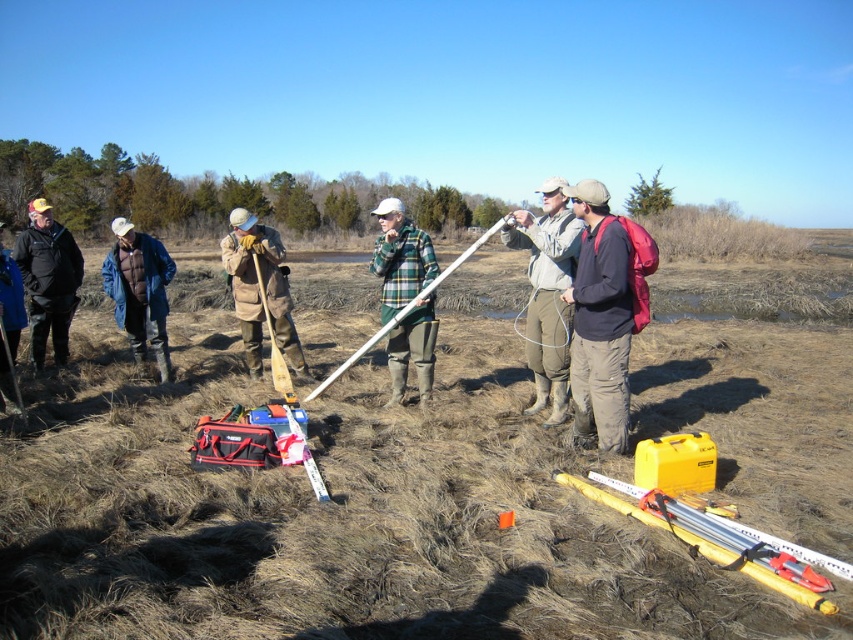
You are part of the fieldwork team and need to determine which clothing item is more suitable for storing small items in its pockets. Based on the description of the brown fuzzy coat at center and the green plaid shirt at center, which one would you choose?

The brown fuzzy coat at center is thinner than the green plaid shirt at center, so the green plaid shirt at center is thicker and likely has more substantial pockets for storing small items.

You are a member of the fieldwork team and need to locate the blue denim jacket at left. According to the coordinates provided, where exactly should you look?

The blue denim jacket at left is located at point (138, 291).

You are standing in the field and see a point marked at coordinates (693, 536). If you need to reach that point, how far will you have to walk?

The distance of point (693, 536) from the viewer is 3.64 meters, so you will have to walk 3.64 meters to reach that point.